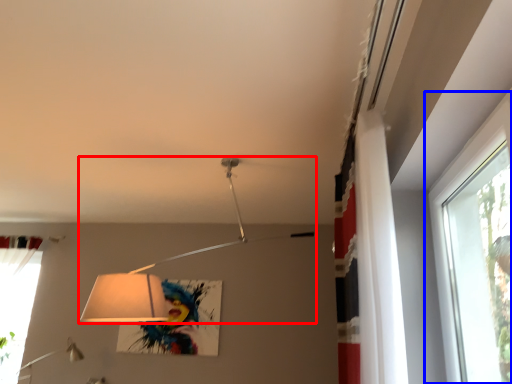
Question: Which point is further to the camera, lamp (highlighted by a red box) or window (highlighted by a blue box)?

Choices:
 (A) lamp
 (B) window

Answer: (A)